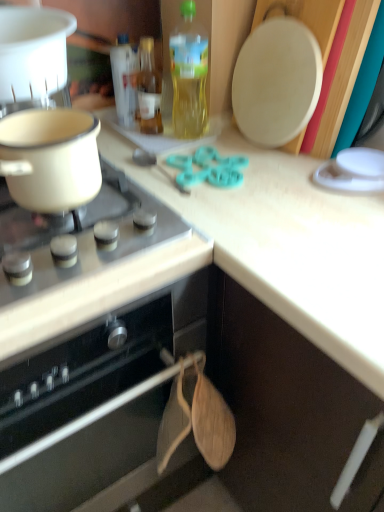
Question: Can you confirm if translucent glass bottle at upper center, which ranks as the second bottle in left-to-right order, is thinner than matte white pot at left, which is the 2th kitchen appliance in top-to-bottom order?

Choices:
 (A) yes
 (B) no

Answer: (A)

Question: From the image's perspective, is translucent glass bottle at upper center, the second bottle in the right-to-left sequence, beneath matte white pot at left, acting as the 1th kitchen appliance starting from the bottom?

Choices:
 (A) yes
 (B) no

Answer: (B)

Question: Would you say translucent glass bottle at upper center, the second bottle in the right-to-left sequence, is outside matte white pot at left, which is the 2th kitchen appliance in top-to-bottom order?

Choices:
 (A) yes
 (B) no

Answer: (A)

Question: Can you confirm if translucent glass bottle at upper center, the second bottle in the right-to-left sequence, is wider than matte white pot at left, acting as the 1th kitchen appliance starting from the bottom?

Choices:
 (A) yes
 (B) no

Answer: (B)

Question: Is translucent glass bottle at upper center, the second bottle in the right-to-left sequence, to the left of matte white pot at left, which is the 2th kitchen appliance in top-to-bottom order, from the viewer's perspective?

Choices:
 (A) no
 (B) yes

Answer: (A)

Question: Does translucent glass bottle at upper center, which ranks as the second bottle in left-to-right order, have a smaller size compared to matte white pot at left, which is the 2th kitchen appliance in top-to-bottom order?

Choices:
 (A) no
 (B) yes

Answer: (B)

Question: Is the position of white plastic pot at upper left, the 1th kitchen appliance when ordered from top to bottom, less distant than that of translucent yellow bottle at upper center, the third bottle viewed from the left?

Choices:
 (A) no
 (B) yes

Answer: (B)

Question: Is white plastic pot at upper left, which is the second kitchen appliance from bottom to top, outside translucent yellow bottle at upper center, the first bottle in the right-to-left sequence?

Choices:
 (A) no
 (B) yes

Answer: (B)

Question: Is translucent yellow bottle at upper center, the third bottle viewed from the left, at the back of white plastic pot at upper left, the 1th kitchen appliance when ordered from top to bottom?

Choices:
 (A) yes
 (B) no

Answer: (B)

Question: Can you confirm if white plastic pot at upper left, the 1th kitchen appliance when ordered from top to bottom, is smaller than translucent yellow bottle at upper center, the first bottle in the right-to-left sequence?

Choices:
 (A) no
 (B) yes

Answer: (A)

Question: Could you tell me if white plastic pot at upper left, which is the second kitchen appliance from bottom to top, is facing translucent yellow bottle at upper center, the third bottle viewed from the left?

Choices:
 (A) no
 (B) yes

Answer: (A)

Question: Is translucent yellow bottle at upper center, the first bottle in the right-to-left sequence, a part of white plastic pot at upper left, which is the second kitchen appliance from bottom to top?

Choices:
 (A) yes
 (B) no

Answer: (B)

Question: Would you say white glossy gas stove at upper left is a long distance from white plastic pot at upper left, which is the second kitchen appliance from bottom to top?

Choices:
 (A) yes
 (B) no

Answer: (B)